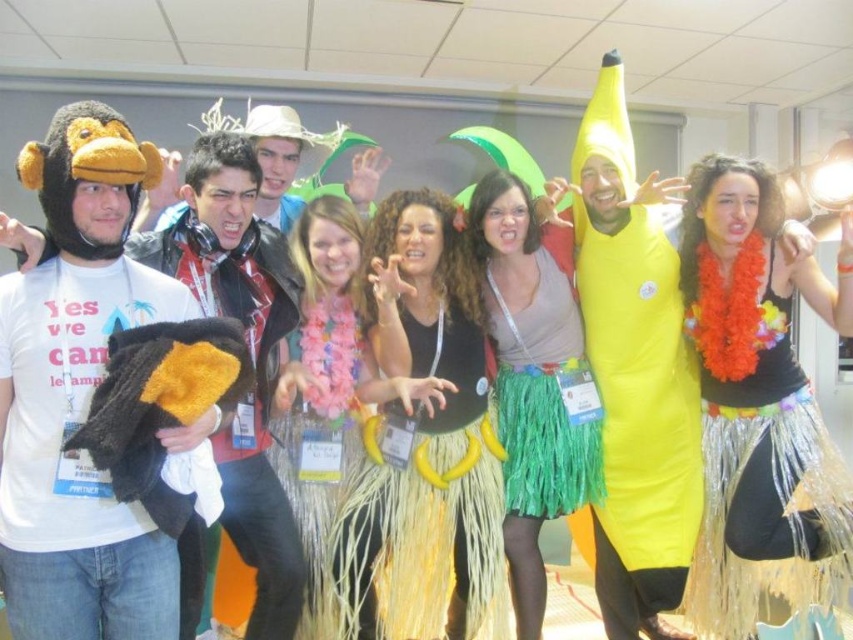
Question: Can you confirm if shiny metallic skirt at center is smaller than yellow grass skirt at center?

Choices:
 (A) yes
 (B) no

Answer: (B)

Question: Which of the following is the closest to the observer?

Choices:
 (A) shiny metallic skirt at center
 (B) fuzzy black and yellow monkey at left
 (C) green grass skirt at center
 (D) fluffy yellow skirt at center

Answer: (B)

Question: Which of the following is the farthest from the observer?

Choices:
 (A) (1, 304)
 (B) (316, 593)
 (C) (827, 467)
 (D) (746, 516)

Answer: (C)

Question: Does fluffy black and yellow bird at center appear on the left side of green grass skirt at center?

Choices:
 (A) yes
 (B) no

Answer: (A)

Question: Is yellow rubber banana at center to the right of yellow inflatable banana at center from the viewer's perspective?

Choices:
 (A) yes
 (B) no

Answer: (A)

Question: Which object appears closest to the camera in this image?

Choices:
 (A) yellow rubber banana at center
 (B) fuzzy black and yellow monkey at left

Answer: (B)